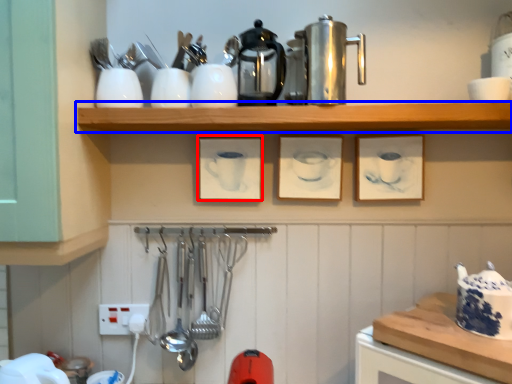
Question: Which object appears farthest to the camera in this image, picture frame (highlighted by a red box) or shelf (highlighted by a blue box)?

Choices:
 (A) picture frame
 (B) shelf

Answer: (A)